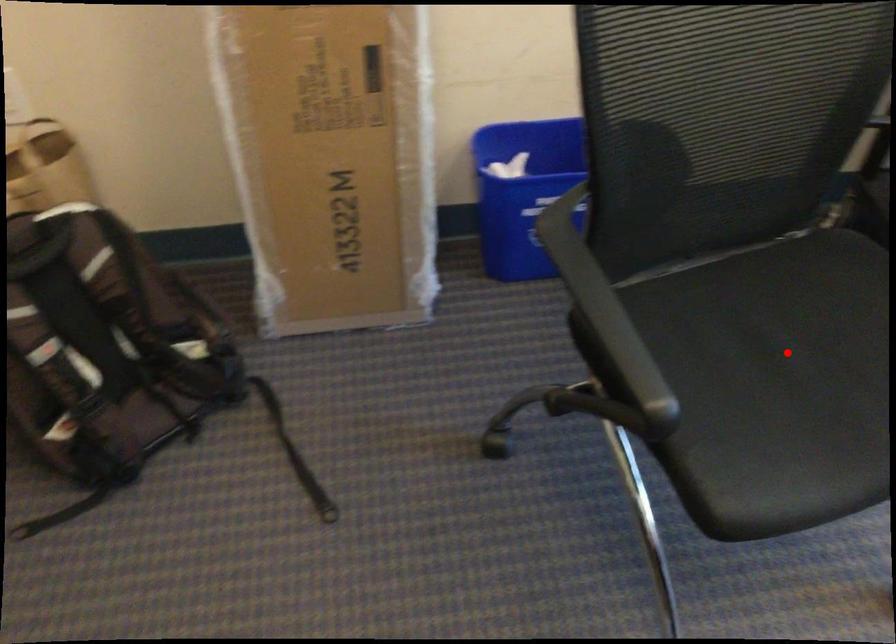
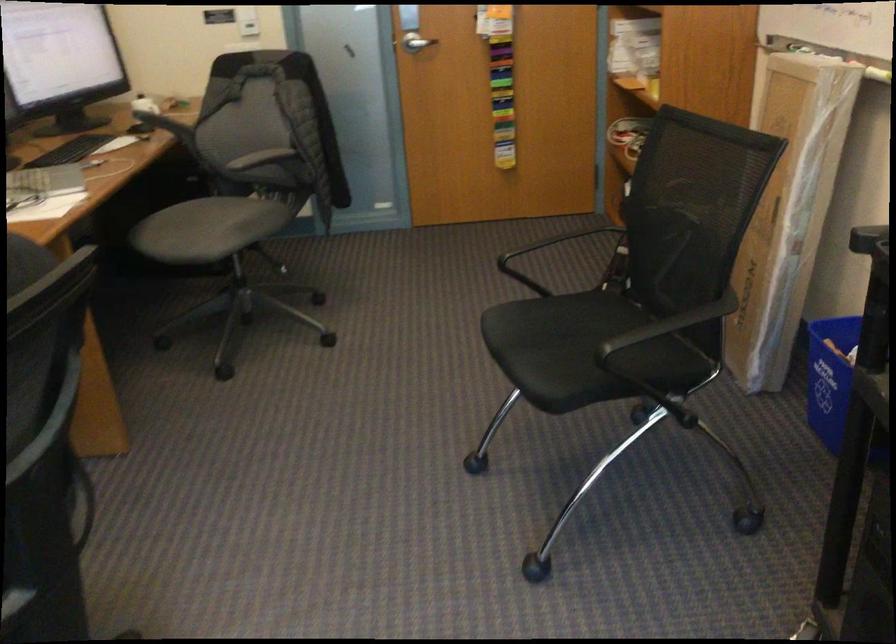
Question: I am providing you with two images of the same scene from different viewpoints. In image1, a red point is highlighted. Considering the same 3D point in image2, which of the following is correct?

Choices:
 (A) It is closer
 (B) It is farther

Answer: (B)